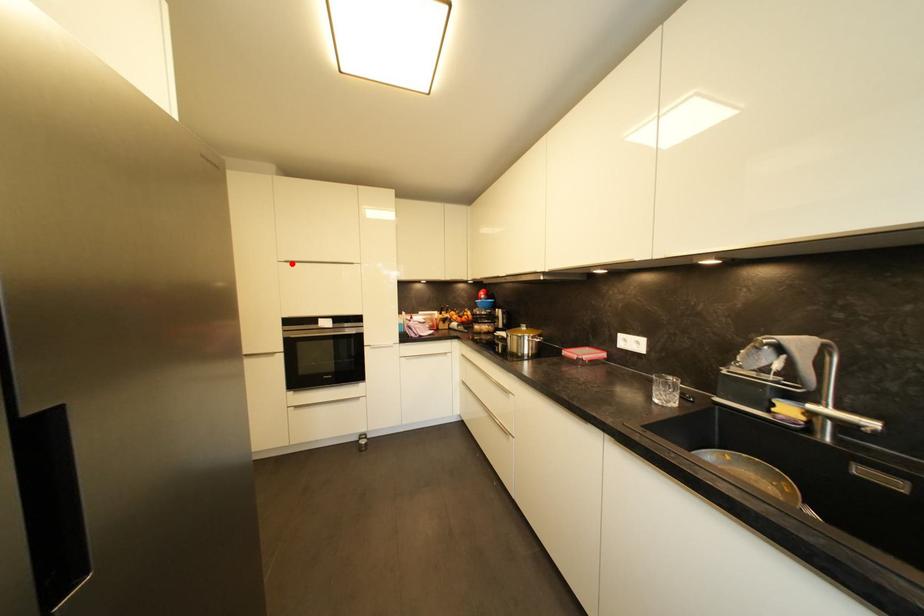
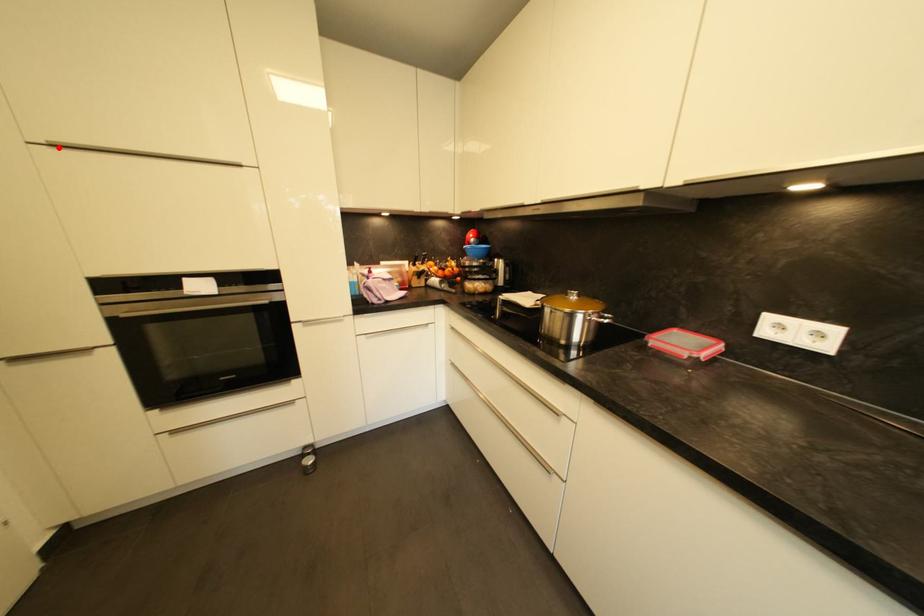
I am providing you with two images of the same scene from different viewpoints. A red point is marked on the first image and another point is marked on the second image. Do the highlighted points in image1 and image2 indicate the same real-world spot?

Yes